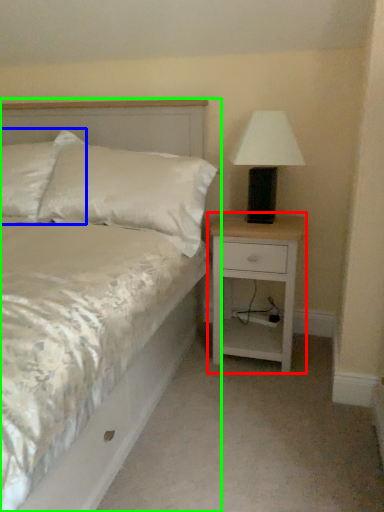
Question: Which object is positioned farthest from nightstand (highlighted by a red box)? Select from pillow (highlighted by a blue box) and bed (highlighted by a green box).

Choices:
 (A) pillow
 (B) bed

Answer: (A)